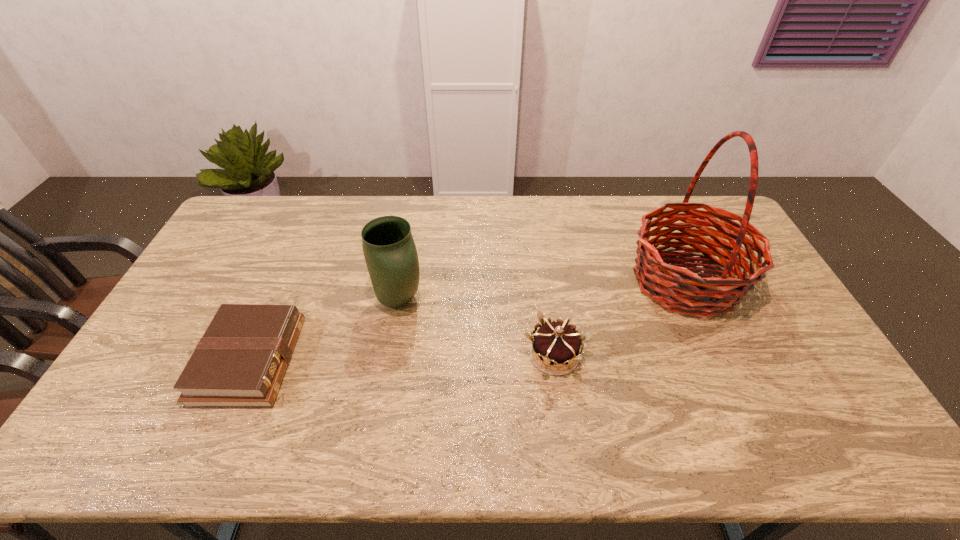
The height and width of the screenshot is (540, 960). In order to click on the rightmost object in this screenshot , I will do `click(696, 295)`.

At what (x,y) coordinates should I click in order to perform the action: click on the tallest object. Please return your answer as a coordinate pair (x, y). This screenshot has width=960, height=540. Looking at the image, I should click on (696, 295).

Locate an element on the screen. This screenshot has width=960, height=540. the second object from left to right is located at coordinates (390, 253).

You are a GUI agent. You are given a task and a screenshot of the screen. Output one action in this format:
    pyautogui.click(x=<x>, y=<y>)
    Task: Click on the vase
    This screenshot has width=960, height=540.
    Given the screenshot: What is the action you would take?
    pyautogui.click(x=390, y=253)

Locate an element on the screen. crown is located at coordinates (556, 343).

Identify the location of the second shortest object. The image size is (960, 540). (556, 343).

You are a GUI agent. You are given a task and a screenshot of the screen. Output one action in this format:
    pyautogui.click(x=<x>, y=<y>)
    Task: Click on the leftmost object
    
    Given the screenshot: What is the action you would take?
    pyautogui.click(x=240, y=362)

You are a GUI agent. You are given a task and a screenshot of the screen. Output one action in this format:
    pyautogui.click(x=<x>, y=<y>)
    Task: Click on the Bible
    This screenshot has width=960, height=540.
    Given the screenshot: What is the action you would take?
    pyautogui.click(x=240, y=362)

Identify the location of vacant space located on the handle side of the rightmost object. This screenshot has width=960, height=540. (586, 281).

Find the location of a particular element. blank area located on the handle side of the rightmost object is located at coordinates (542, 281).